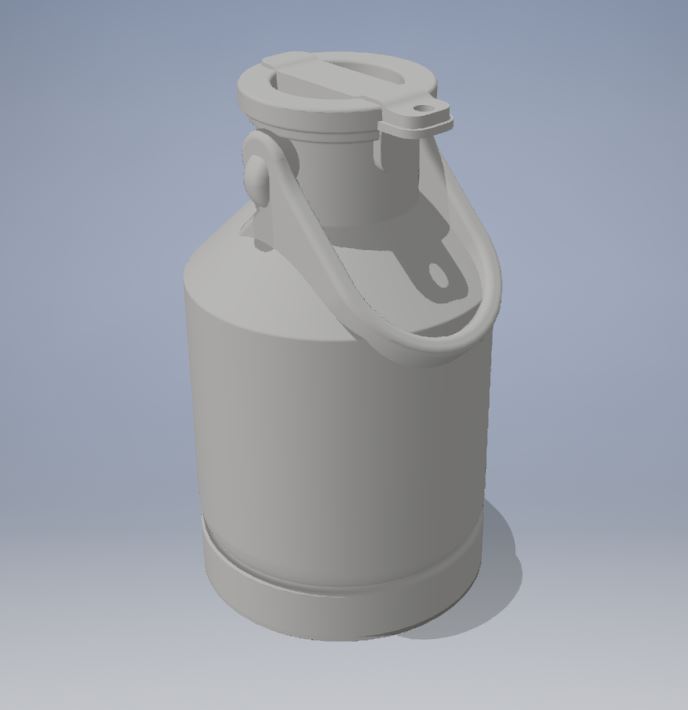
I want to click on bottle, so click(316, 309).